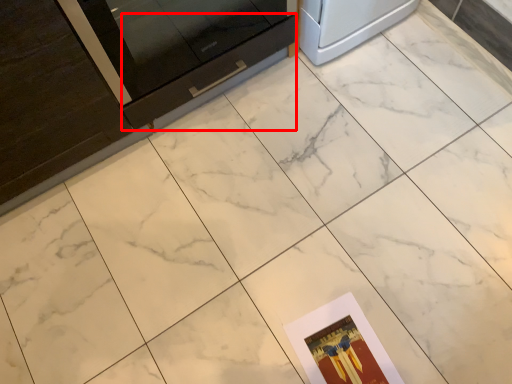
Question: From the image's perspective, what is the correct spatial positioning of drawer (annotated by the red box) in reference to postcard?

Choices:
 (A) above
 (B) below

Answer: (A)